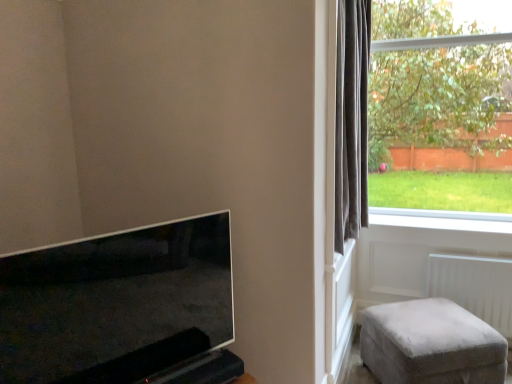
Question: Is white smooth window sill at lower right spatially inside white plastic radiator at lower right, or outside of it?

Choices:
 (A) outside
 (B) inside

Answer: (A)

Question: From the image's perspective, is white smooth window sill at lower right positioned above or below white plastic radiator at lower right?

Choices:
 (A) below
 (B) above

Answer: (B)

Question: Which object is the farthest from the transparent glass window at right?

Choices:
 (A) dark grey velvet curtain at right
 (B) matte black tv at lower left
 (C) velvet grey ottoman at lower right
 (D) white plastic radiator at lower right
 (E) white smooth window sill at lower right

Answer: (B)

Question: Which object is the farthest from the transparent glass window at right?

Choices:
 (A) matte black tv at lower left
 (B) white smooth window sill at lower right
 (C) white plastic radiator at lower right
 (D) velvet grey ottoman at lower right
 (E) dark grey velvet curtain at right

Answer: (A)